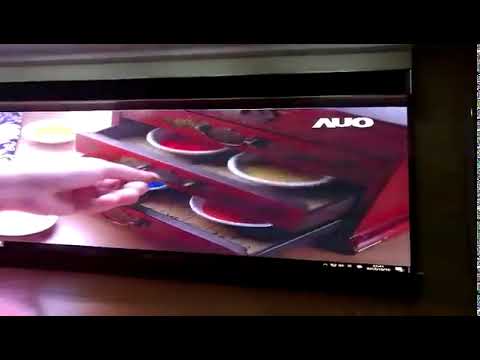
Identify the location of reflection from screen. The height and width of the screenshot is (360, 480). (51, 307).